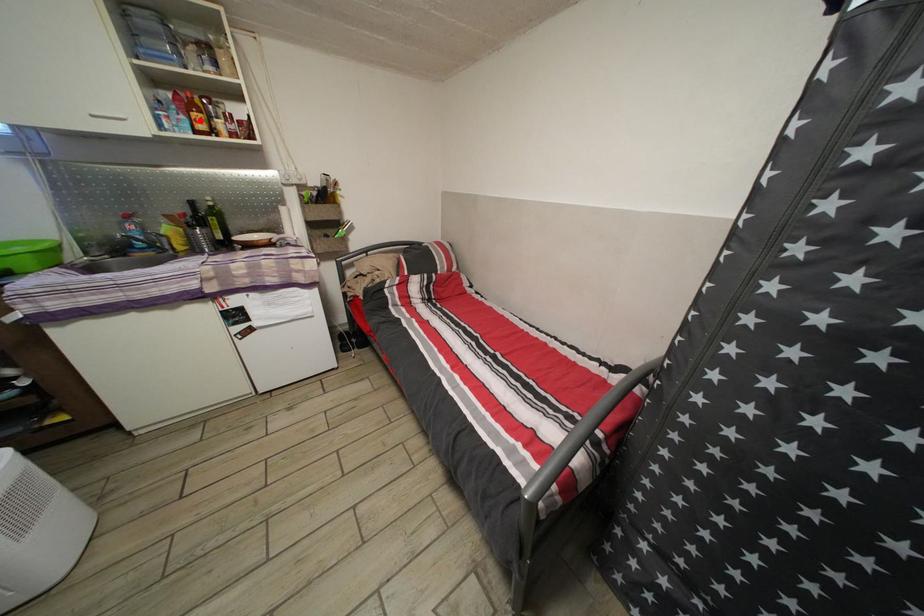
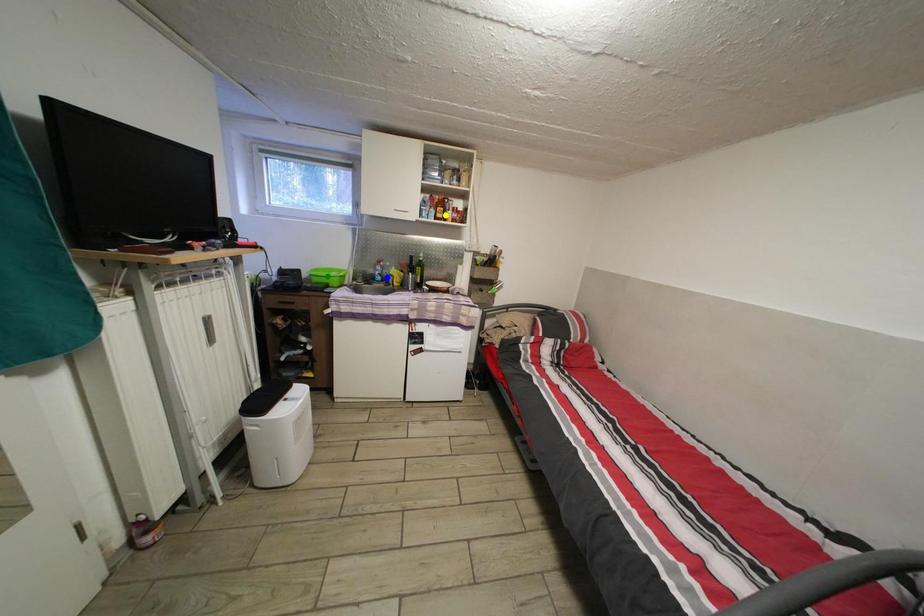
Question: I am providing you with two images of the same scene from different viewpoints. A red point is marked on the first image. You are given multiple points on the second image. In image 2, which mark is for the same physical point as the one in image 1?

Choices:
 (A) green point
 (B) yellow point
 (C) blue point

Answer: (B)